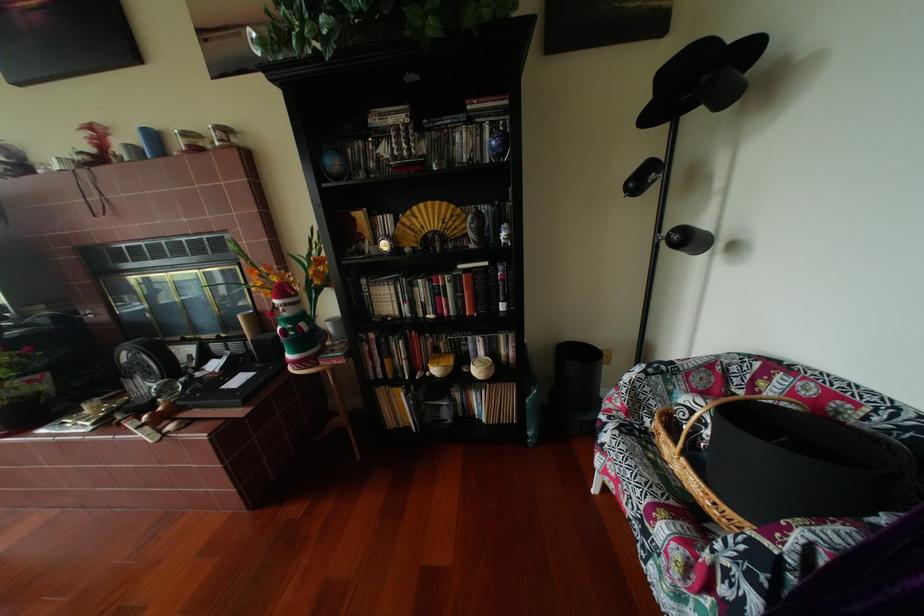
What do you see at coordinates (152, 142) in the screenshot? I see `the blue mug` at bounding box center [152, 142].